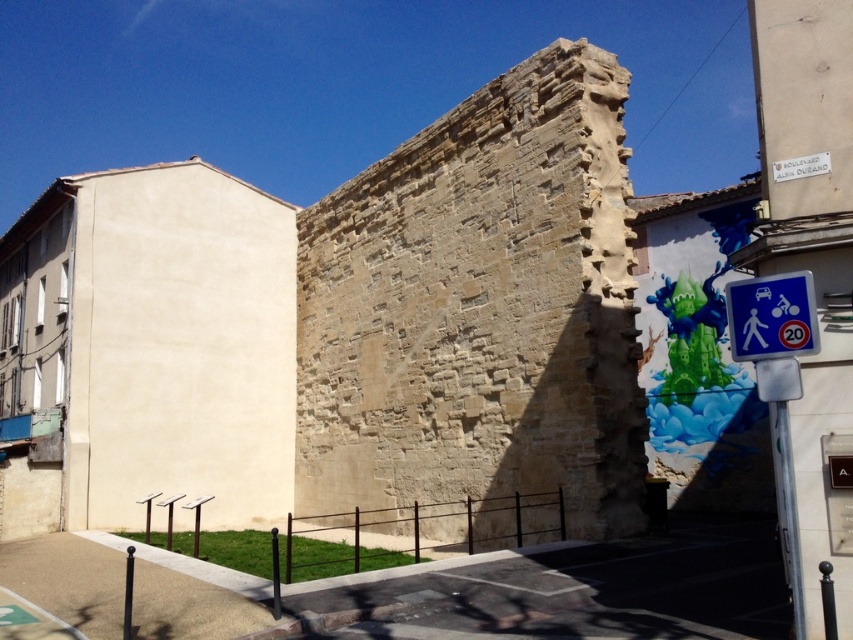
Question: Which point appears closest to the camera in this image?

Choices:
 (A) (810, 310)
 (B) (343, 484)

Answer: (A)

Question: Does brown stone wall at center appear over blue plastic speed limit sign at right?

Choices:
 (A) yes
 (B) no

Answer: (B)

Question: Is brown stone wall at center wider than blue plastic speed limit sign at right?

Choices:
 (A) no
 (B) yes

Answer: (B)

Question: Can you confirm if brown stone wall at center is wider than blue plastic speed limit sign at right?

Choices:
 (A) yes
 (B) no

Answer: (A)